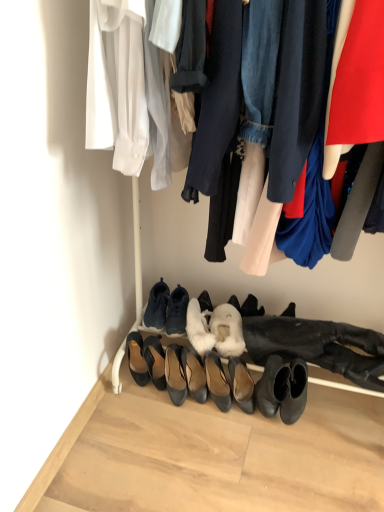
Question: Which direction should I rotate to look at white fur boot at center, which ranks as the second shoe in right-to-left order?

Choices:
 (A) left
 (B) right

Answer: (B)

Question: Can you confirm if white fluffy slipper at center, positioned as the second shoe in left-to-right order, is positioned to the left of black leather heels at lower center, arranged as the eighth footwear when viewed from the right?

Choices:
 (A) yes
 (B) no

Answer: (B)

Question: Is white fluffy slipper at center, which is the first shoe from right to left, completely or partially outside of black leather heels at lower center, arranged as the eighth footwear when viewed from the right?

Choices:
 (A) yes
 (B) no

Answer: (A)

Question: From a real-world perspective, is white fluffy slipper at center, positioned as the second shoe in left-to-right order, on top of black leather heels at lower center, placed as the 1th footwear when sorted from left to right?

Choices:
 (A) yes
 (B) no

Answer: (A)

Question: Considering the relative sizes of white fluffy slipper at center, which is the first shoe from right to left, and black leather heels at lower center, arranged as the eighth footwear when viewed from the right, in the image provided, is white fluffy slipper at center, which is the first shoe from right to left, bigger than black leather heels at lower center, arranged as the eighth footwear when viewed from the right,?

Choices:
 (A) no
 (B) yes

Answer: (B)

Question: Is white fluffy slipper at center, which is the first shoe from right to left, far away from black leather heels at lower center, placed as the 1th footwear when sorted from left to right?

Choices:
 (A) no
 (B) yes

Answer: (A)

Question: Is white fluffy slipper at center, which is the first shoe from right to left, facing towards black leather heels at lower center, arranged as the eighth footwear when viewed from the right?

Choices:
 (A) yes
 (B) no

Answer: (B)

Question: Is matte black heels at center, which is counted as the seventh footwear, starting from the left, not inside black leather heels at lower center, arranged as the eighth footwear when viewed from the right?

Choices:
 (A) no
 (B) yes

Answer: (B)

Question: Is matte black heels at center, which is counted as the seventh footwear, starting from the left, aimed at black leather heels at lower center, placed as the 1th footwear when sorted from left to right?

Choices:
 (A) yes
 (B) no

Answer: (B)

Question: Is matte black heels at center, which appears as the 2th footwear when viewed from the right, further to the viewer compared to black leather heels at lower center, arranged as the eighth footwear when viewed from the right?

Choices:
 (A) no
 (B) yes

Answer: (A)

Question: Would you say matte black heels at center, which is counted as the seventh footwear, starting from the left, is a long distance from black leather heels at lower center, placed as the 1th footwear when sorted from left to right?

Choices:
 (A) yes
 (B) no

Answer: (B)

Question: From a real-world perspective, is matte black heels at center, which appears as the 2th footwear when viewed from the right, under black leather heels at lower center, arranged as the eighth footwear when viewed from the right?

Choices:
 (A) no
 (B) yes

Answer: (B)

Question: Is matte black heels at center, which appears as the 2th footwear when viewed from the right, bigger than black leather heels at lower center, arranged as the eighth footwear when viewed from the right?

Choices:
 (A) no
 (B) yes

Answer: (B)

Question: Can you confirm if black leather heels at center, the 4th footwear viewed from the left, is wider than shiny black heels at center, marked as the 3th footwear in a right-to-left arrangement?

Choices:
 (A) yes
 (B) no

Answer: (A)